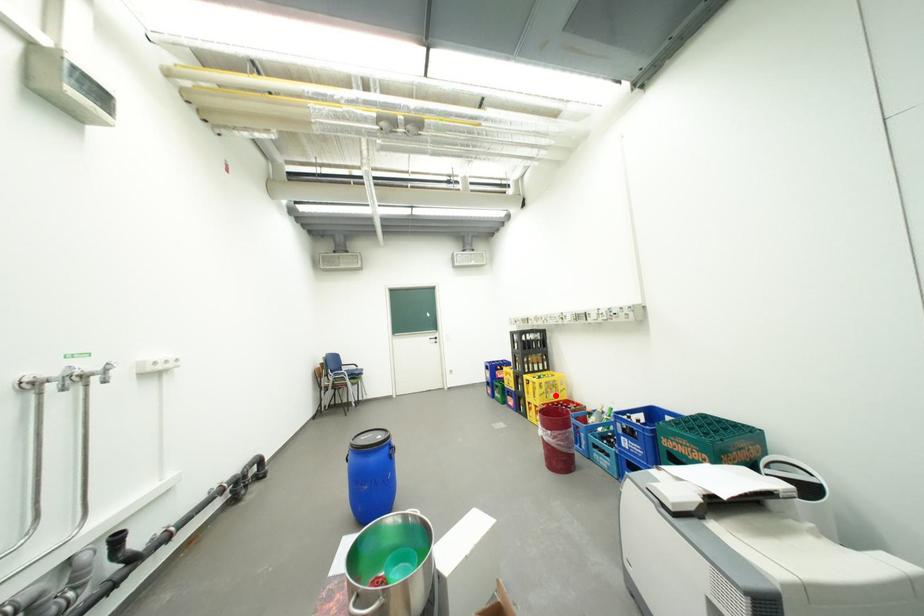
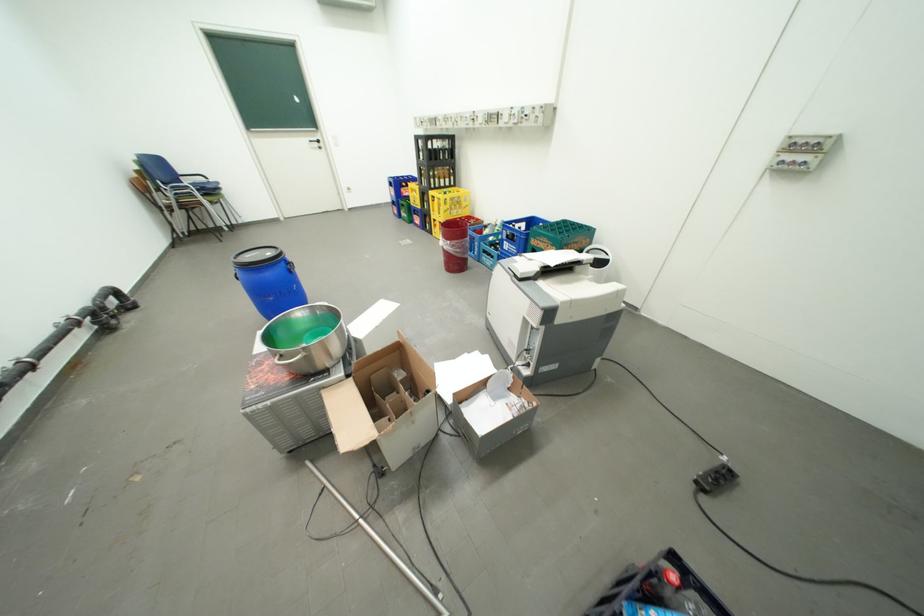
Question: A red point is marked in image1. In image2, is the corresponding 3D point closer to the camera or farther? Reply with the corresponding letter.

Choices:
 (A) The corresponding 3D point is closer.
 (B) The corresponding 3D point is farther.

Answer: (A)